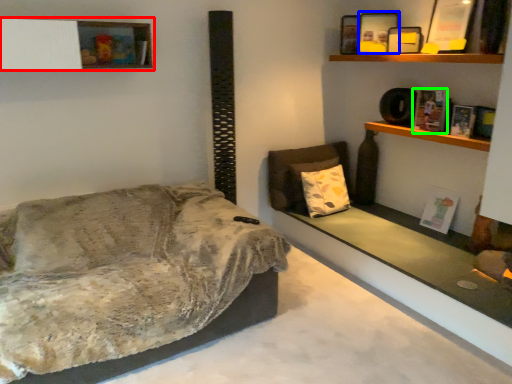
Question: Considering the real-world distances, which object is farthest from shelf (highlighted by a red box)? picture frame (highlighted by a blue box) or book (highlighted by a green box)?

Choices:
 (A) picture frame
 (B) book

Answer: (B)